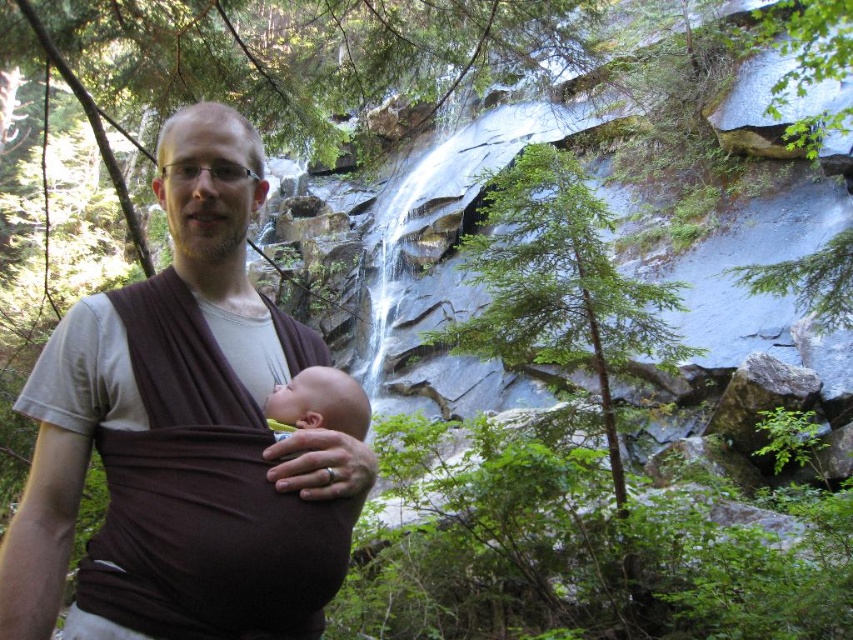
Does brown fabric baby carrier at center come in front of smooth brown baby at center?

Yes.

Does brown fabric baby carrier at center appear on the right side of smooth brown baby at center?

In fact, brown fabric baby carrier at center is to the left of smooth brown baby at center.

What do you see at coordinates (183, 435) in the screenshot?
I see `brown fabric baby carrier at center` at bounding box center [183, 435].

This screenshot has width=853, height=640. Find the location of `brown fabric baby carrier at center`. brown fabric baby carrier at center is located at coordinates (183, 435).